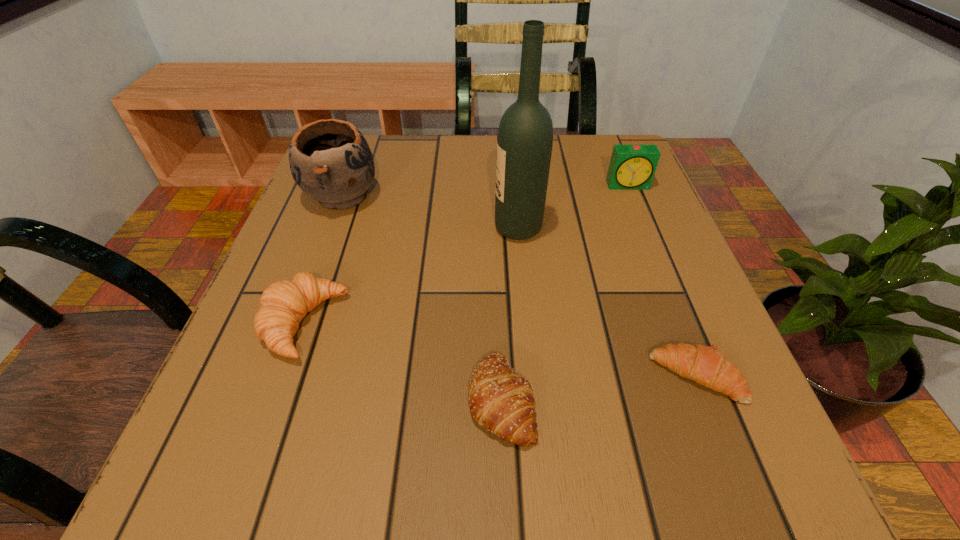
Where is `the closest object relative to the fourth shortest object`? Image resolution: width=960 pixels, height=540 pixels. the closest object relative to the fourth shortest object is located at coordinates (525, 136).

You are a GUI agent. You are given a task and a screenshot of the screen. Output one action in this format:
    pyautogui.click(x=<x>, y=<y>)
    Task: Click on the third closest object to the second crescent roll from left to right
    
    Given the screenshot: What is the action you would take?
    pyautogui.click(x=525, y=136)

Locate which crescent roll is the second closest to the rightmost crescent roll. Please provide its 2D coordinates. Your answer should be formatted as a tuple, i.e. [(x, y)], where the tuple contains the x and y coordinates of a point satisfying the conditions above.

[(283, 305)]

Point out which crescent roll is positioned as the third nearest to the alarm clock. Please provide its 2D coordinates. Your answer should be formatted as a tuple, i.e. [(x, y)], where the tuple contains the x and y coordinates of a point satisfying the conditions above.

[(283, 305)]

Locate an element on the screen. The image size is (960, 540). free point that satisfies the following two spatial constraints: 1. on the front-facing side of the alarm clock; 2. on the labeled side of the tallest object is located at coordinates (646, 228).

Where is `free point that satisfies the following two spatial constraints: 1. on the labeled side of the rightmost crescent roll; 2. on the left side of the wine bottle`? free point that satisfies the following two spatial constraints: 1. on the labeled side of the rightmost crescent roll; 2. on the left side of the wine bottle is located at coordinates (532, 376).